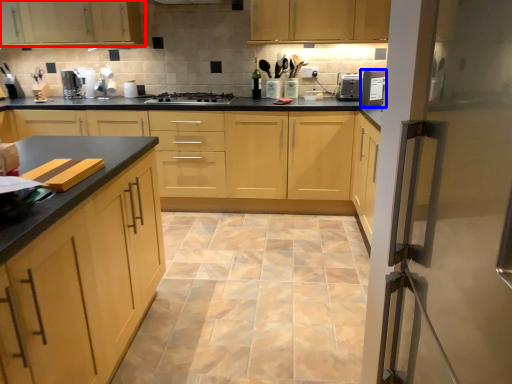
Question: Which object appears farthest to the camera in this image, cabinetry (highlighted by a red box) or home appliance (highlighted by a blue box)?

Choices:
 (A) cabinetry
 (B) home appliance

Answer: (A)